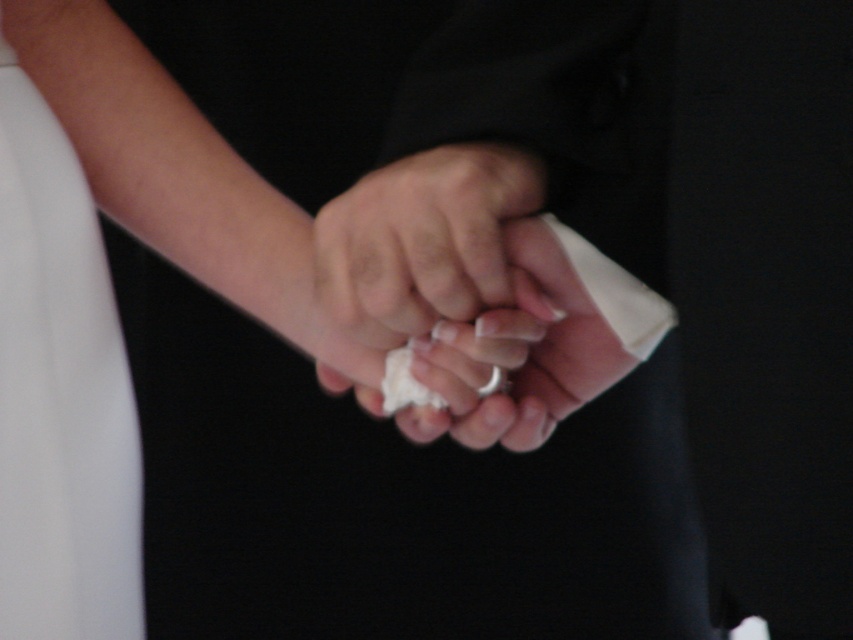
Who is higher up, white satin dress at left or white matte tissue at center?

white matte tissue at center is above.

Is point (26, 518) closer to viewer compared to point (352, 300)?

That is False.

Locate an element on the screen. The image size is (853, 640). white satin dress at left is located at coordinates (61, 394).

What do you see at coordinates (61, 394) in the screenshot? I see `white satin dress at left` at bounding box center [61, 394].

Can you confirm if white satin dress at left is thinner than white matte cloth at center?

Indeed, white satin dress at left has a lesser width compared to white matte cloth at center.

Locate an element on the screen. This screenshot has width=853, height=640. white satin dress at left is located at coordinates (61, 394).

Is white satin dress at left thinner than silver metallic ring at center?

In fact, white satin dress at left might be wider than silver metallic ring at center.

What do you see at coordinates (61, 394) in the screenshot? I see `white satin dress at left` at bounding box center [61, 394].

I want to click on white satin dress at left, so click(61, 394).